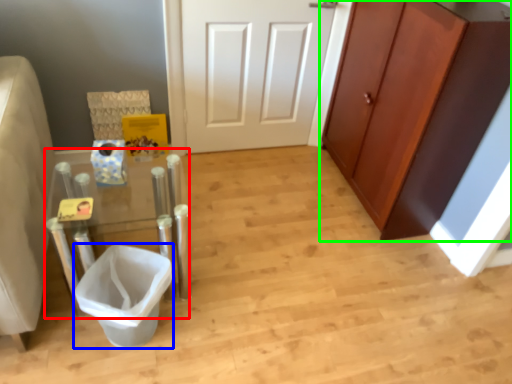
Question: Based on their relative distances, which object is farther from vanity (highlighted by a red box)? Choose from toilet bowl (highlighted by a blue box) and cabinetry (highlighted by a green box).

Choices:
 (A) toilet bowl
 (B) cabinetry

Answer: (B)